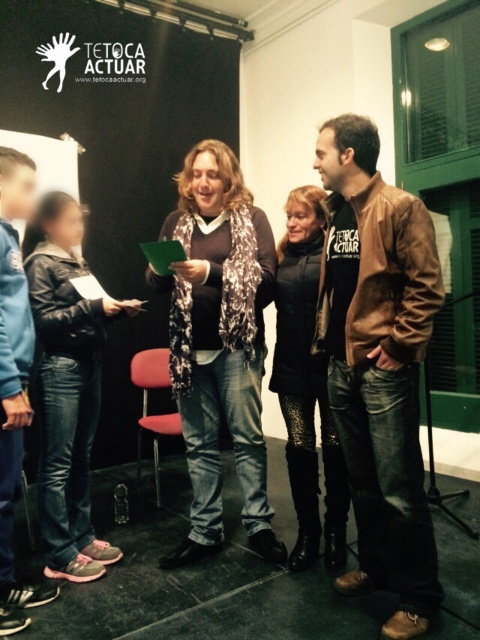
In the scene described, there are two jackets present. The brown leather jacket at center and the blue fleece jacket at lower left. From the perspective of someone standing in front of the backdrop, which jacket is positioned to the right of the other?

The brown leather jacket at center is to the right of the blue fleece jacket at lower left.